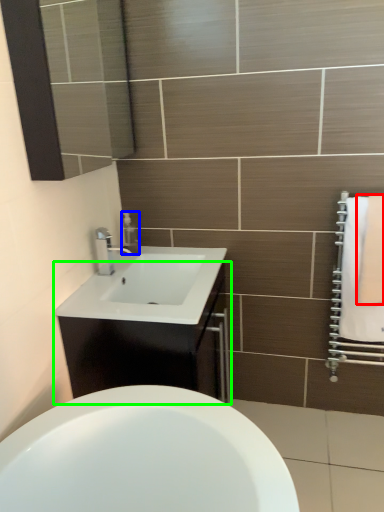
Question: Estimate the real-world distances between objects in this image. Which object is farther from bath towel (highlighted by a red box), soap dispenser (highlighted by a blue box) or bathroom cabinet (highlighted by a green box)?

Choices:
 (A) soap dispenser
 (B) bathroom cabinet

Answer: (A)